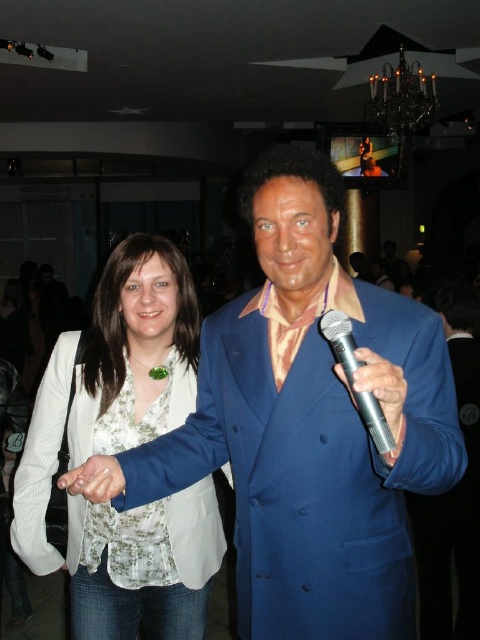
Does blue velvet suit at center appear over metallic silver microphone at right?

Actually, blue velvet suit at center is below metallic silver microphone at right.

Which is behind, point (476, 536) or point (373, 384)?

The point (476, 536) is more distant.

Is point (459, 582) closer to camera compared to point (340, 369)?

No, it is not.

Identify the location of blue velvet suit at center. (453, 490).

Can you confirm if blue glossy suit at center is positioned to the right of white matte hand at center?

Indeed, blue glossy suit at center is positioned on the right side of white matte hand at center.

Between blue glossy suit at center and white matte hand at center, which one has less height?

With less height is white matte hand at center.

Is point (290, 369) in front of point (97, 483)?

That is False.

This screenshot has height=640, width=480. I want to click on blue glossy suit at center, so click(x=310, y=424).

Can you confirm if blue glossy suit at center is taller than silver metallic microphone at right?

Yes, blue glossy suit at center is taller than silver metallic microphone at right.

This screenshot has width=480, height=640. What do you see at coordinates (310, 424) in the screenshot? I see `blue glossy suit at center` at bounding box center [310, 424].

Identify the location of blue glossy suit at center. The width and height of the screenshot is (480, 640). (310, 424).